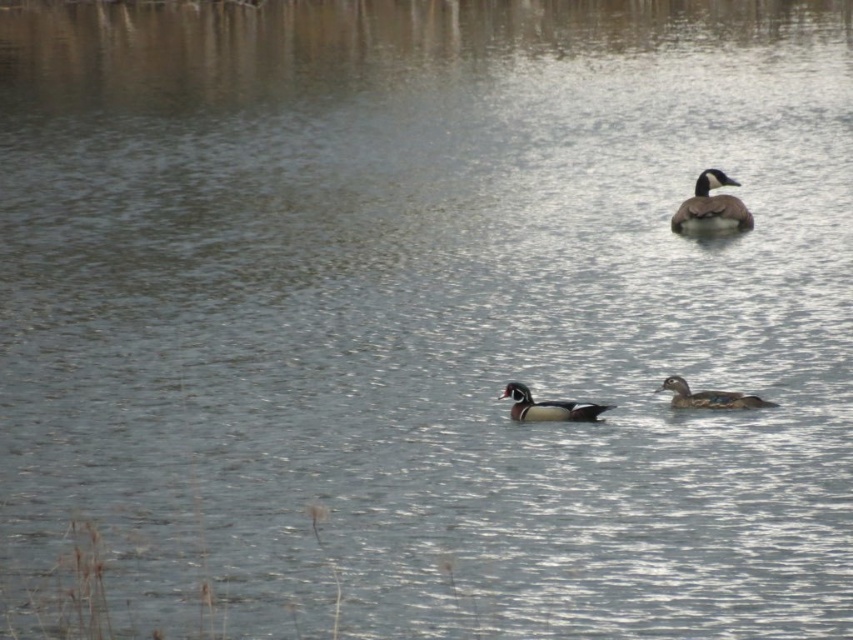
You are standing at the edge of the lake and see two points marked on the water surface. The first point is at coordinates point (723, 173) and the second point is at point (573, 401). Which point is closer to you?

Point (573, 401) is closer to you because the point (723, 173) is further to the camera than point (573, 401).